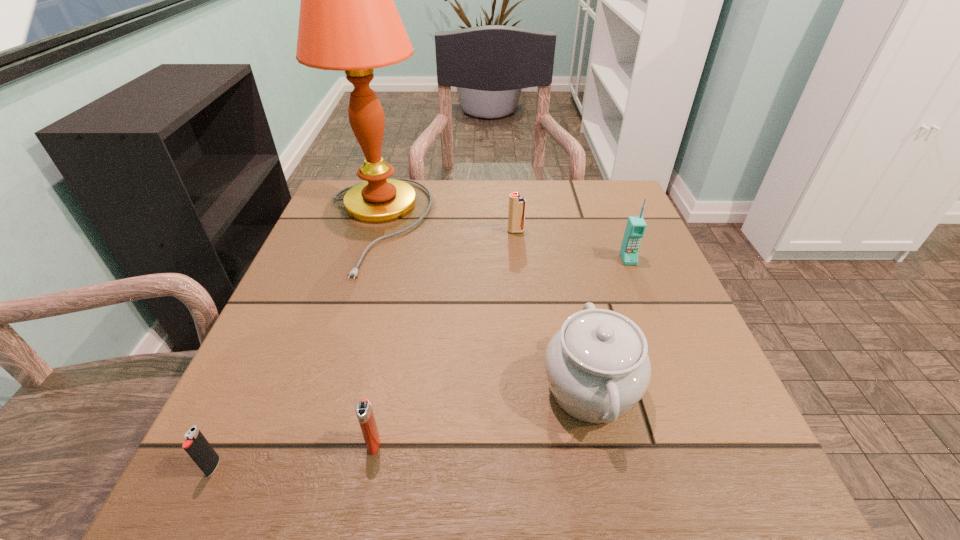
Find the location of `vacant space positioned on the back of the farthest igniter`. vacant space positioned on the back of the farthest igniter is located at coordinates (515, 217).

The height and width of the screenshot is (540, 960). What are the coordinates of `free space located on the right of the second nearest igniter` in the screenshot? It's located at (647, 443).

Locate an element on the screen. free location located 0.360m on the back of the shortest igniter is located at coordinates (298, 284).

You are a GUI agent. You are given a task and a screenshot of the screen. Output one action in this format:
    pyautogui.click(x=<x>, y=<y>)
    Task: Click on the lamp that is positioned at the far edge
    The image size is (960, 540).
    Given the screenshot: What is the action you would take?
    pyautogui.click(x=348, y=21)

At what (x,y) coordinates should I click in order to perform the action: click on igniter that is at the far edge. Please return your answer as a coordinate pair (x, y). The width and height of the screenshot is (960, 540). Looking at the image, I should click on click(x=517, y=204).

You are a GUI agent. You are given a task and a screenshot of the screen. Output one action in this format:
    pyautogui.click(x=<x>, y=<y>)
    Task: Click on the chinaware that is positioned at the near edge
    Image resolution: width=960 pixels, height=540 pixels.
    Given the screenshot: What is the action you would take?
    pyautogui.click(x=597, y=366)

Identify the location of lamp that is at the left edge. This screenshot has height=540, width=960. coord(348,21).

Locate an element on the screen. The width and height of the screenshot is (960, 540). igniter that is at the left edge is located at coordinates [196, 445].

Locate an element on the screen. Image resolution: width=960 pixels, height=540 pixels. cellular telephone located at the right edge is located at coordinates (636, 226).

The width and height of the screenshot is (960, 540). I want to click on chinaware situated at the right edge, so click(x=597, y=366).